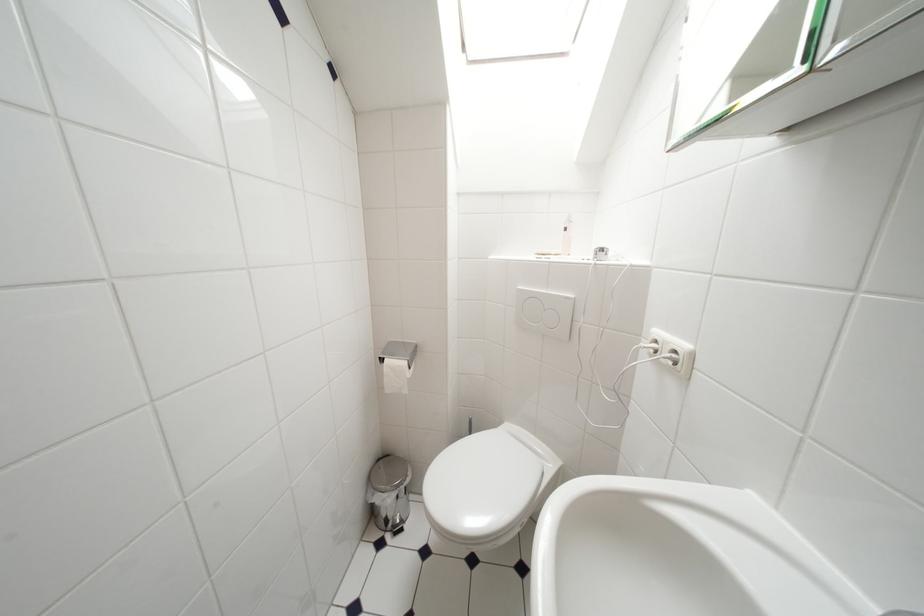
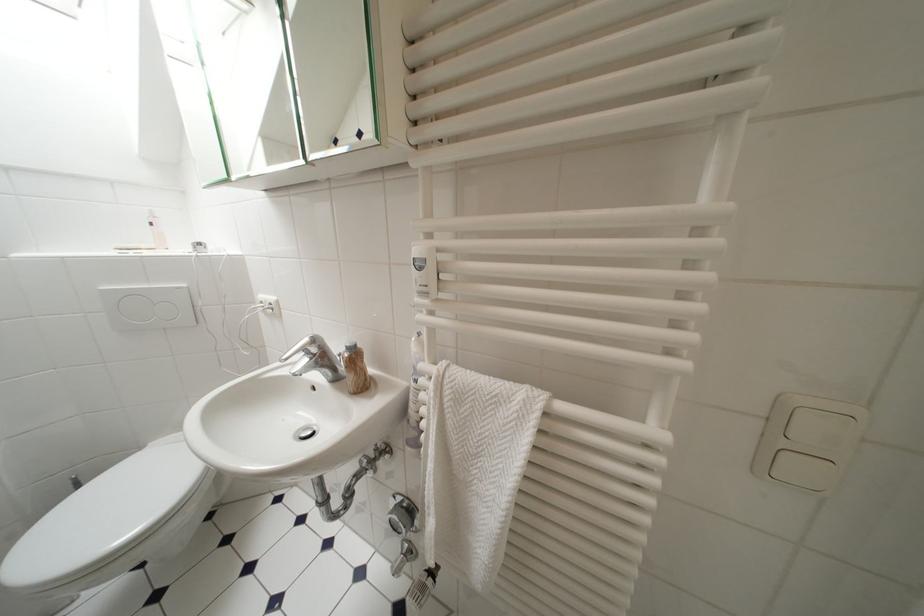
Find the pixel in the second image that matches (x=506, y=428) in the first image.

(148, 451)